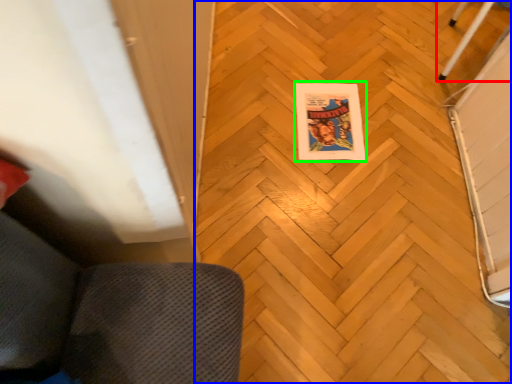
Question: Based on their relative distances, which object is nearer to furniture (highlighted by a red box)? Choose from plywood (highlighted by a blue box) and comic book (highlighted by a green box).

Choices:
 (A) plywood
 (B) comic book

Answer: (B)